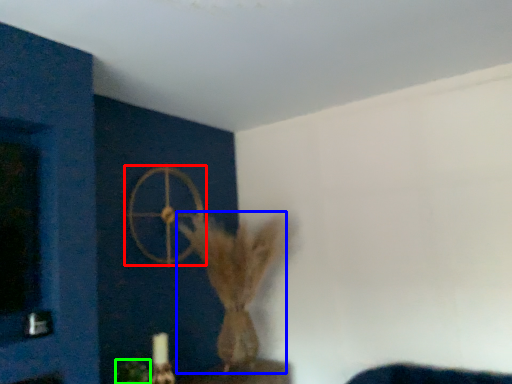
Question: Estimate the real-world distances between objects in this image. Which object is closer to wheel (highlighted by a red box), animal (highlighted by a blue box) or plant (highlighted by a green box)?

Choices:
 (A) animal
 (B) plant

Answer: (A)